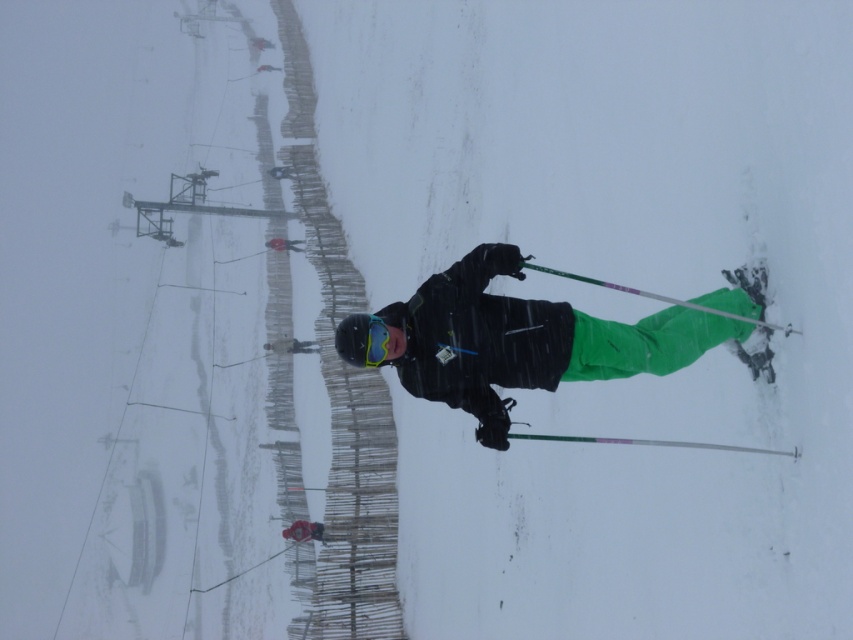
Between matte blue goggles at center and matte black helmet at center, which one appears on the left side from the viewer's perspective?

Positioned to the left is matte black helmet at center.

Is matte blue goggles at center below matte black helmet at center?

No, matte blue goggles at center is not below matte black helmet at center.

What are the coordinates of `matte blue goggles at center` in the screenshot? It's located at (375, 340).

Does matte black snowboarder at center have a larger size compared to matte blue goggles at center?

Correct, matte black snowboarder at center is larger in size than matte blue goggles at center.

Identify the location of matte black snowboarder at center. click(526, 340).

Between point (595, 365) and point (374, 316), which one is positioned behind?

Point (595, 365)

The image size is (853, 640). I want to click on matte black snowboarder at center, so pos(526,340).

Between matte black snowboarder at center and matte black helmet at center, which one has more height?

With more height is matte black snowboarder at center.

Who is more distant from viewer, [593,371] or [311,525]?

Point [311,525]

Describe the element at coordinates (526, 340) in the screenshot. I see `matte black snowboarder at center` at that location.

Where is `matte black snowboarder at center`? The height and width of the screenshot is (640, 853). matte black snowboarder at center is located at coordinates (526, 340).